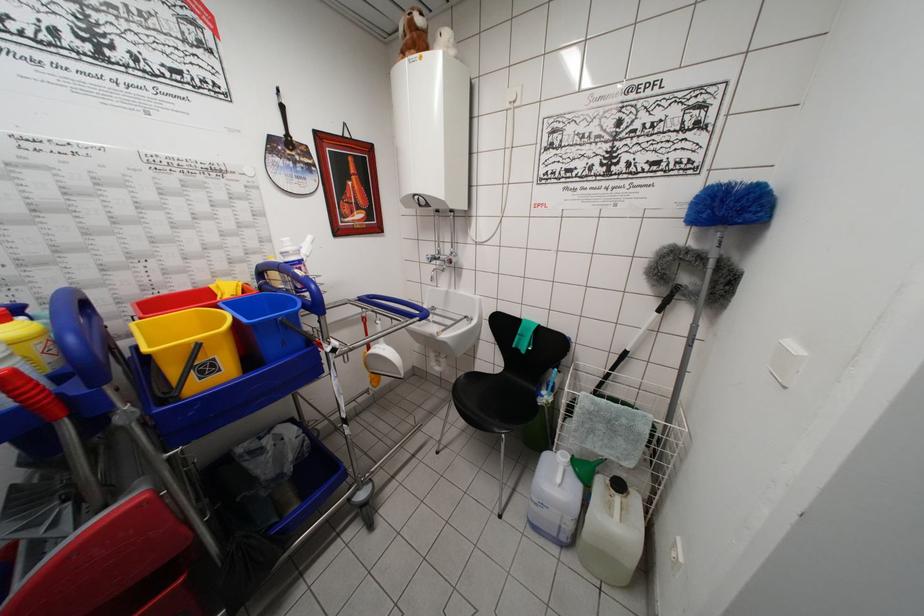
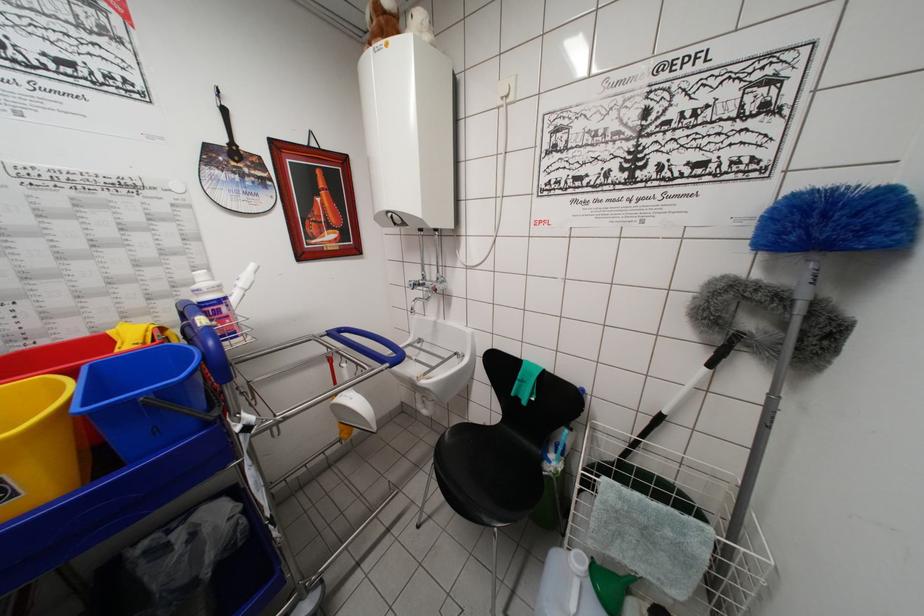
Locate, in the second image, the point that corresponds to pixel 723 199 in the first image.

(821, 209)